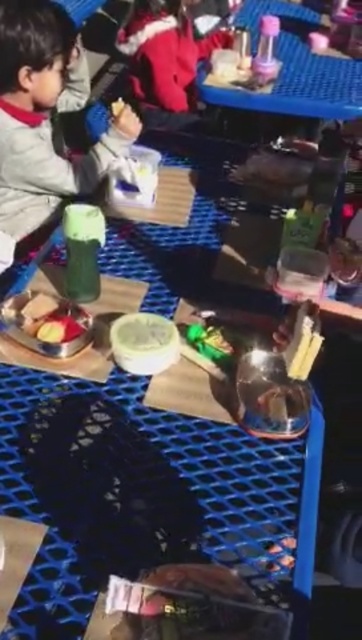
Who is more forward, [10,192] or [157,54]?

Positioned in front is point [10,192].

Based on the photo, can you confirm if matte gray jacket at left is shorter than red fleece jacket at upper center?

Incorrect, matte gray jacket at left's height does not fall short of red fleece jacket at upper center's.

At what (x,y) coordinates should I click in order to perform the action: click on matte gray jacket at left. Please return your answer as a coordinate pair (x, y). The image size is (362, 640). Looking at the image, I should click on (44, 115).

Locate an element on the screen. Image resolution: width=362 pixels, height=640 pixels. matte gray jacket at left is located at coordinates (44, 115).

Who is shorter, matte gray jacket at left or smooth plastic apple at center?

With less height is smooth plastic apple at center.

Is matte gray jacket at left further to camera compared to smooth plastic apple at center?

Yes, matte gray jacket at left is behind smooth plastic apple at center.

Which is behind, point (69, 45) or point (53, 326)?

Point (69, 45)

Find the location of a particular element. This screenshot has width=362, height=640. matte gray jacket at left is located at coordinates (44, 115).

Does translucent plastic tray at upper right have a larger size compared to matte green plastic cup at upper left?

Correct, translucent plastic tray at upper right is larger in size than matte green plastic cup at upper left.

Can you confirm if translucent plastic tray at upper right is smaller than matte green plastic cup at upper left?

Actually, translucent plastic tray at upper right might be larger than matte green plastic cup at upper left.

Between point (317, 72) and point (118, 100), which one is positioned in front?

Point (317, 72) is more forward.

Where is `translucent plastic tray at upper right`? translucent plastic tray at upper right is located at coordinates (292, 72).